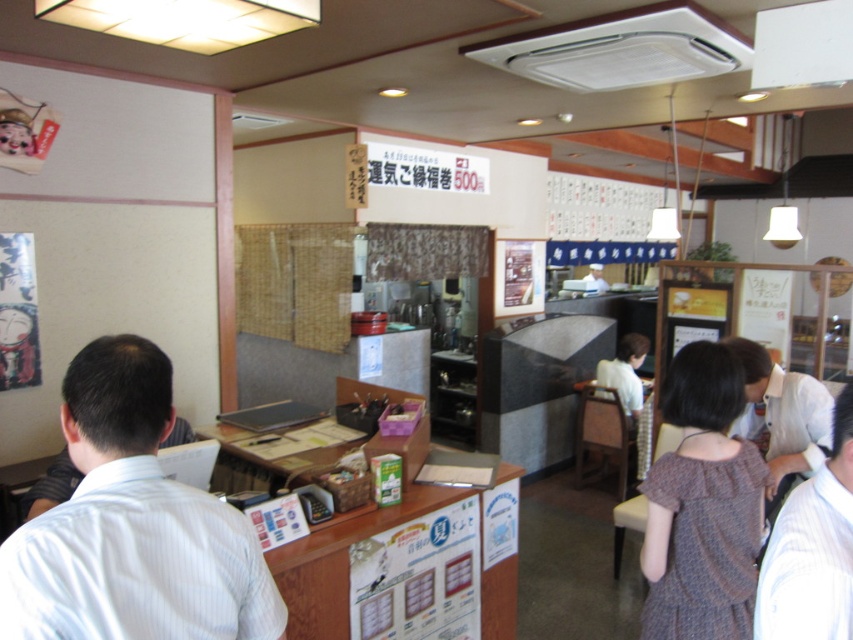
You are a customer at this Japanese restaurant and want to order food. Which staff member should you approach first, the one wearing the white striped shirt at left or the white uniform at center?

You should approach the white uniform at center first because the white striped shirt at left is below it, indicating they might be in a position closer to the service area.

You are a delivery person standing at the entrance of the Japanese restaurant. You need to hand over a package to the woman wearing the brown textured dress at center. The delivery robot you are using has a maximum reach of 1.8 meters. Can the robot reach the woman without moving?

The brown textured dress at center and the camera are 1.74 meters apart. Since the delivery robot has a maximum reach of 1.8 meters, it can reach the woman wearing the brown textured dress at center without needing to move.

You are standing at the entrance of the Japanese restaurant and see two points on the counter. The first point is at coordinate point (x=724, y=444) and the second is at point (x=605, y=289). Which point is closer to you?

Point (x=724, y=444) is closer to the viewer than point (x=605, y=289) according to the description.